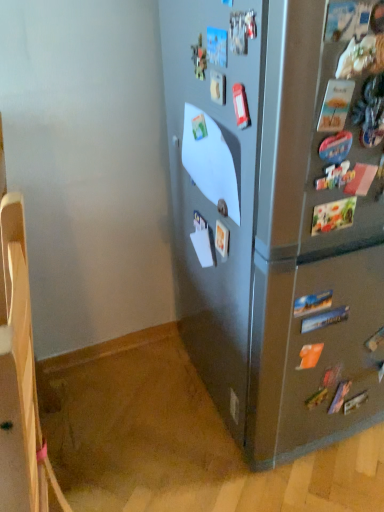
The height and width of the screenshot is (512, 384). What are the coordinates of `vacant point to the left of satin silver refrigerator at center` in the screenshot? It's located at (141, 402).